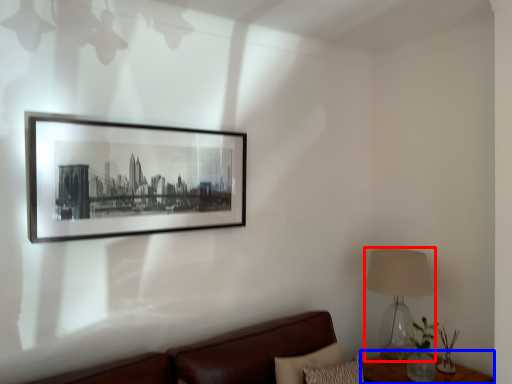
Question: Which object is closer to the camera taking this photo, table lamp (highlighted by a red box) or table (highlighted by a blue box)?

Choices:
 (A) table lamp
 (B) table

Answer: (B)